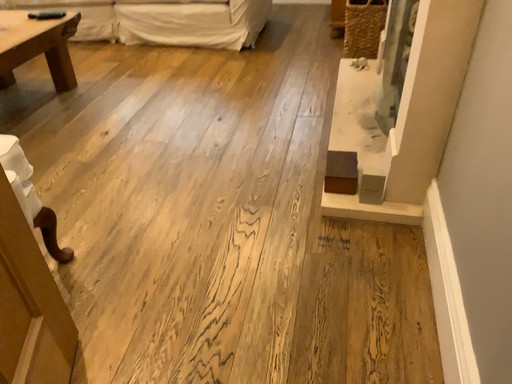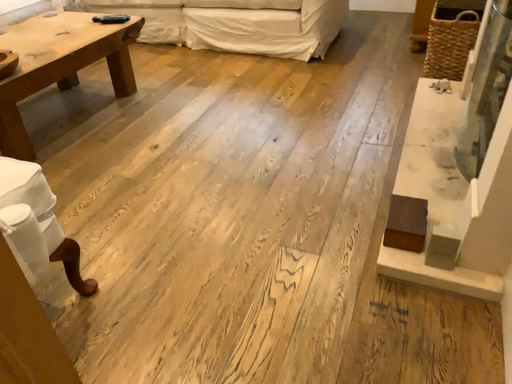
Question: Which way did the camera rotate in the video?

Choices:
 (A) rotated left
 (B) rotated right

Answer: (A)